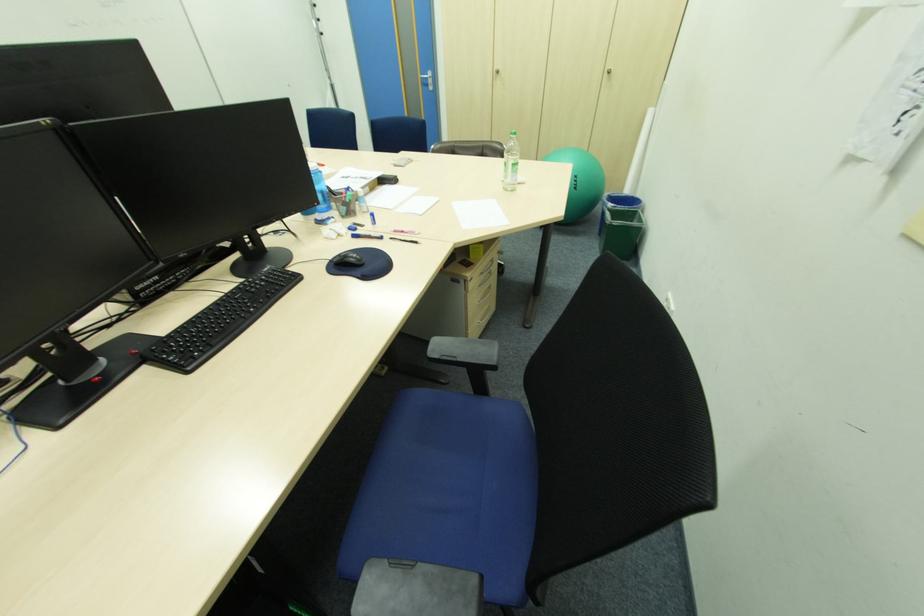
What do you see at coordinates (428, 79) in the screenshot? This screenshot has width=924, height=616. I see `the silver door handle` at bounding box center [428, 79].